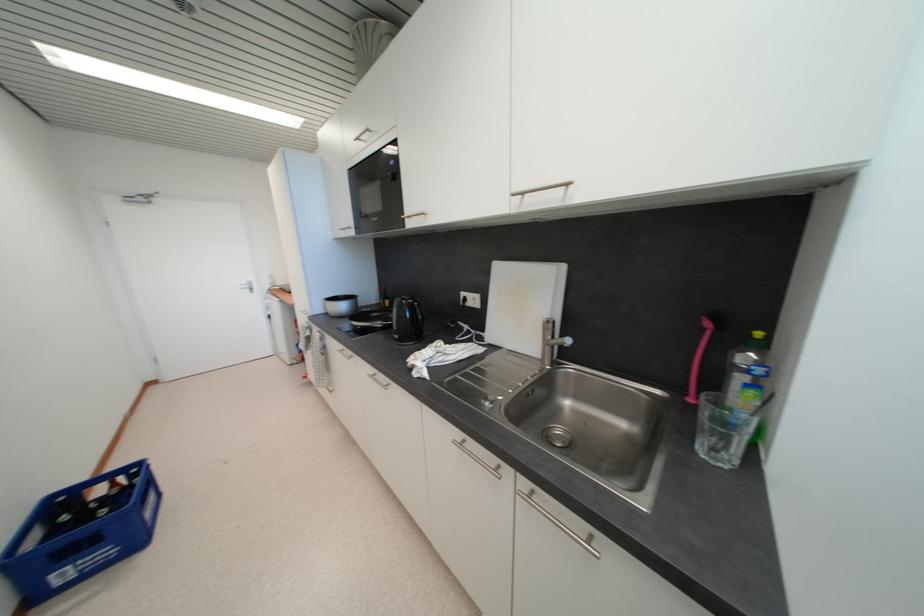
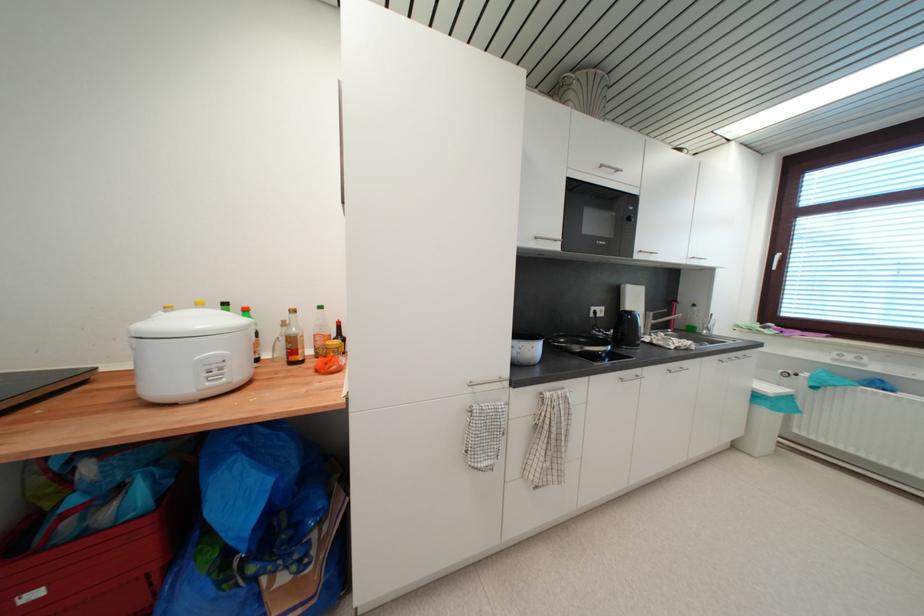
Find the pixel in the second image that matches (x=467, y=305) in the first image.

(597, 317)